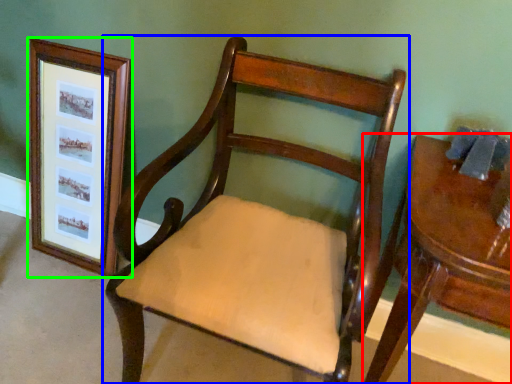
Question: Which object is positioned closest to table (highlighted by a red box)? Select from chair (highlighted by a blue box) and picture frame (highlighted by a green box).

Choices:
 (A) chair
 (B) picture frame

Answer: (A)